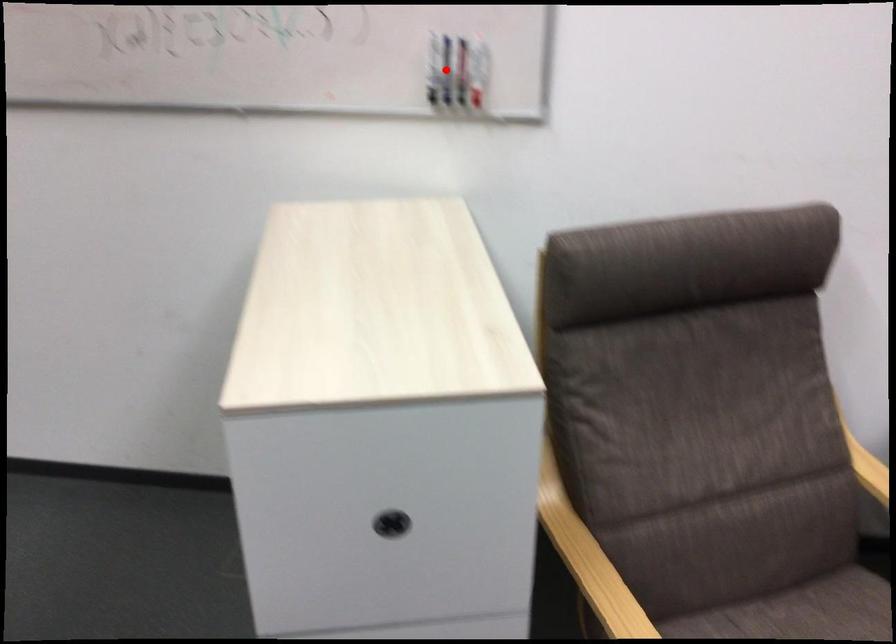
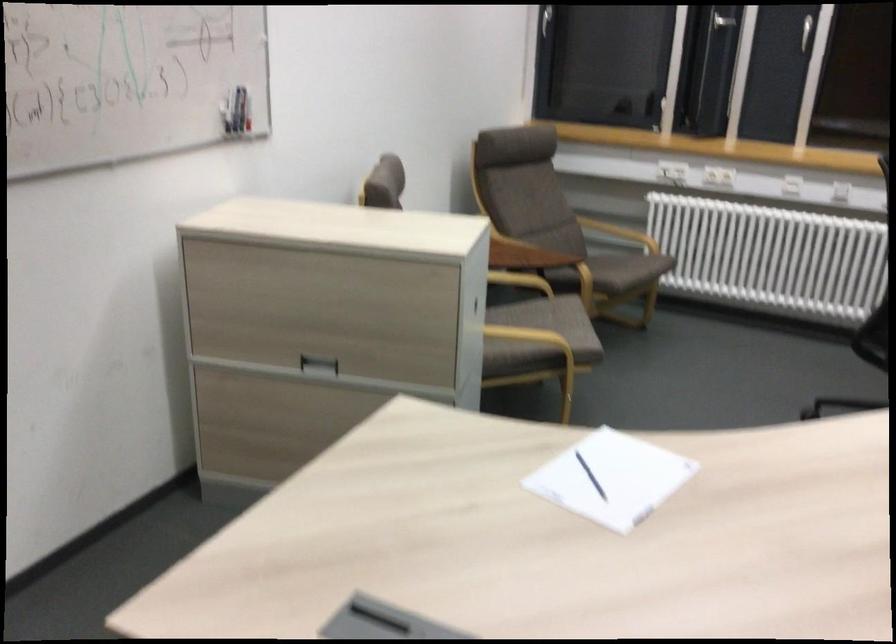
Question: I am providing you with two images of the same scene from different viewpoints. In image1, a red point is highlighted. Considering the same 3D point in image2, which of the following is correct?

Choices:
 (A) It is closer
 (B) It is farther

Answer: (B)